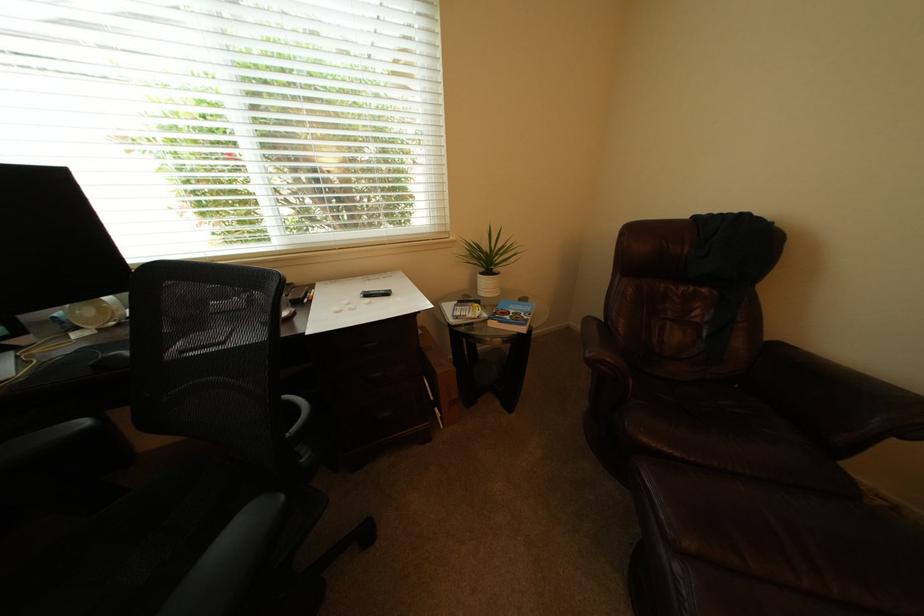
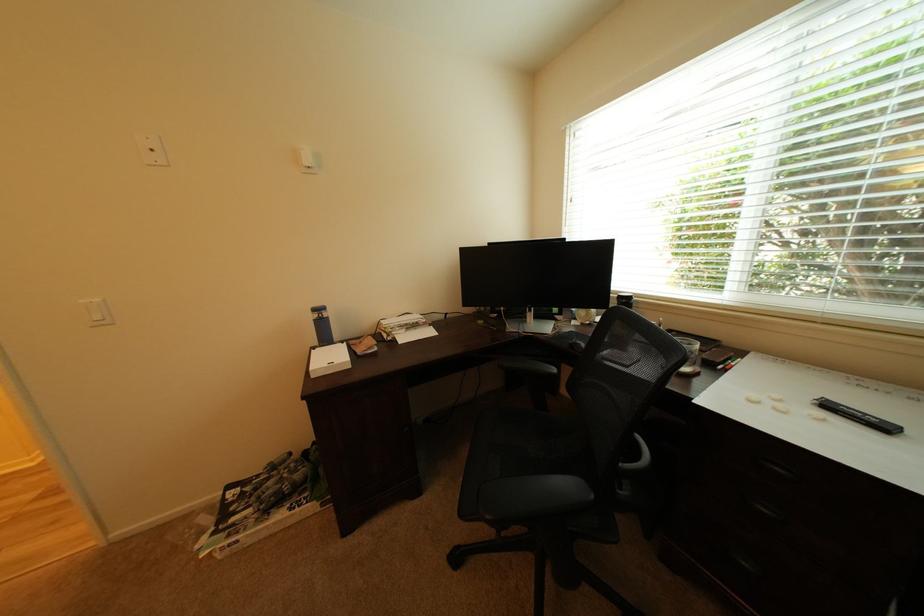
Where in the second image is the point corresponding to the point at 378,297 from the first image?

(840, 408)